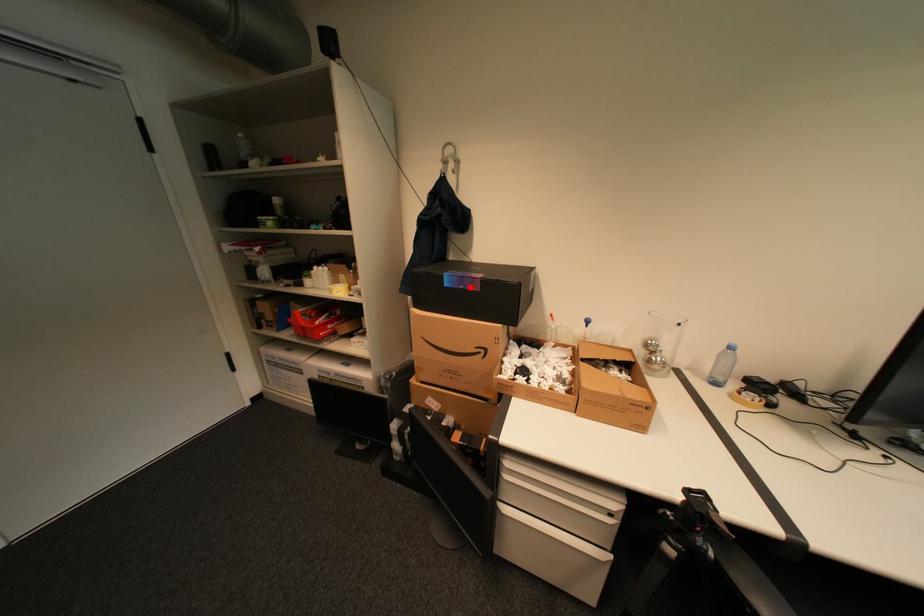
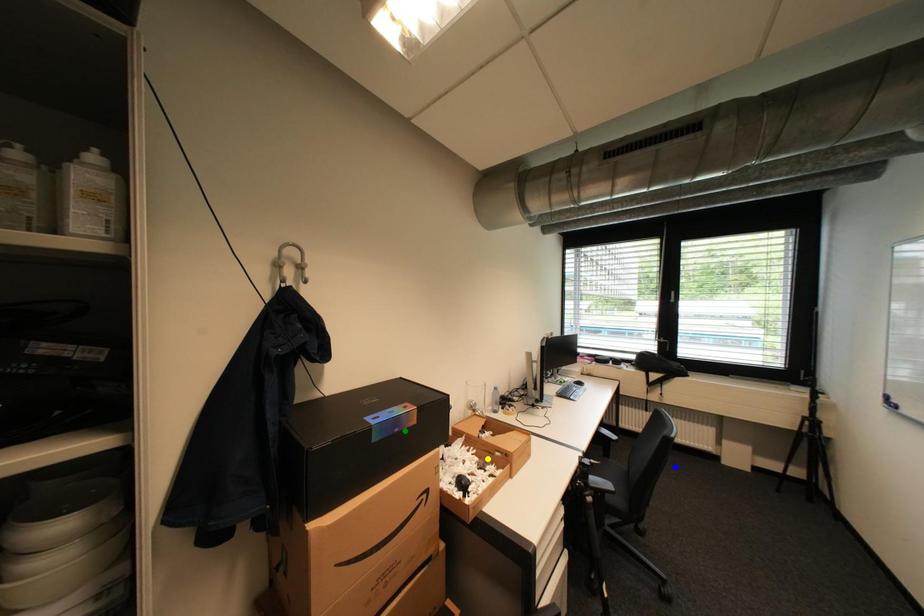
Question: I am providing you with two images of the same scene from different viewpoints. A red point is marked on the first image. You are given multiple points on the second image. Can you choose the point in image 2 that corresponds to the point in image 1?

Choices:
 (A) blue point
 (B) yellow point
 (C) green point

Answer: (C)